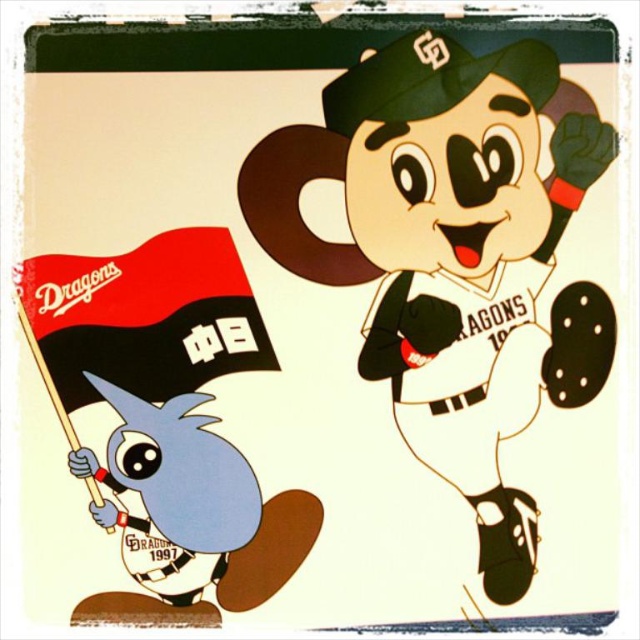
You are a photographer trying to capture a clear photo of the matte black mascot at right and the black fabric flag at lower left. However, the lighting is poor. Which object might be harder to see due to its color and position? Explain your reasoning.

The matte black mascot at right might be harder to see because it is positioned over the black fabric flag at lower left, creating a similar color contrast between the two black objects, making it difficult to distinguish them in low light conditions.